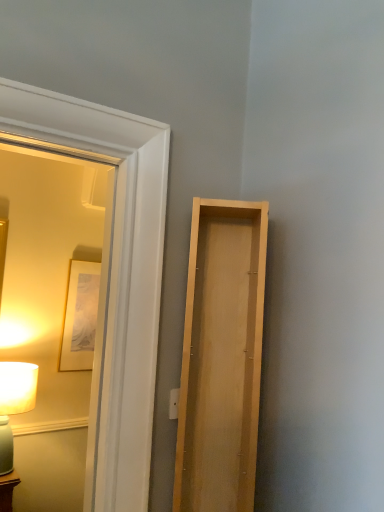
Question: From their relative heights in the image, would you say light wood door at right is taller or shorter than matte wooden mirror at left?

Choices:
 (A) tall
 (B) short

Answer: (B)

Question: In terms of width, does light wood door at right look wider or thinner when compared to matte wooden mirror at left?

Choices:
 (A) thin
 (B) wide

Answer: (B)

Question: Which object is positioned farthest from the matte white lamp at left?

Choices:
 (A) light wood door at right
 (B) matte wooden mirror at left

Answer: (A)

Question: Considering the real-world distances, which object is farthest from the matte wooden mirror at left?

Choices:
 (A) matte white lamp at left
 (B) light wood door at right

Answer: (B)